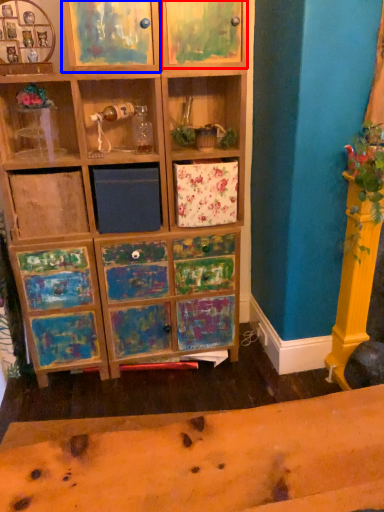
Question: Which object is further to the camera taking this photo, cabinet (highlighted by a red box) or cabinet (highlighted by a blue box)?

Choices:
 (A) cabinet
 (B) cabinet

Answer: (A)